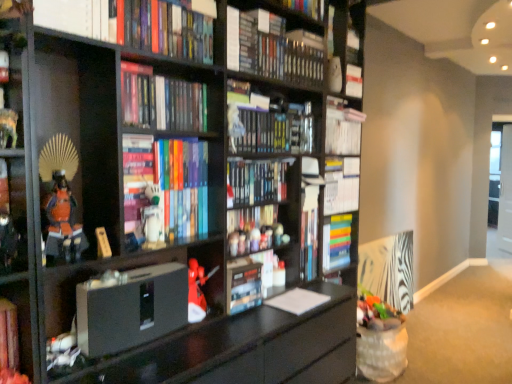
Question: Is hardcover book at upper left, which is the 6th book from bottom to top, positioned behind matte black shelf at left, which ranks as the second shelf in bottom-to-top order?

Choices:
 (A) no
 (B) yes

Answer: (B)

Question: Does hardcover book at upper left, the 4th book viewed from the top, have a smaller size compared to matte black shelf at left, which ranks as the second shelf in bottom-to-top order?

Choices:
 (A) no
 (B) yes

Answer: (A)

Question: From the image's perspective, is hardcover book at upper left, the 4th book viewed from the top, on matte black shelf at left, which ranks as the second shelf in bottom-to-top order?

Choices:
 (A) yes
 (B) no

Answer: (A)

Question: Is hardcover book at upper left, which is the 6th book from bottom to top, to the left of matte black shelf at left, which ranks as the second shelf in bottom-to-top order, from the viewer's perspective?

Choices:
 (A) yes
 (B) no

Answer: (B)

Question: From a real-world perspective, is hardcover book at upper left, the 4th book viewed from the top, beneath matte black shelf at left, which ranks as the second shelf in bottom-to-top order?

Choices:
 (A) no
 (B) yes

Answer: (A)

Question: Is hardcover book at upper left, the 4th book viewed from the top, turned away from matte black shelf at left, the first shelf in the top-to-bottom sequence?

Choices:
 (A) yes
 (B) no

Answer: (B)

Question: From a real-world perspective, is white paper at center, marked as the third paperback book in a left-to-right arrangement, beneath hardcover book at upper center, placed as the 3th book when sorted from top to bottom?

Choices:
 (A) yes
 (B) no

Answer: (A)

Question: From the image's perspective, is white paper at center, marked as the 1th paperback book in a right-to-left arrangement, on top of hardcover book at upper center, the seventh book positioned from the bottom?

Choices:
 (A) no
 (B) yes

Answer: (A)

Question: Considering the relative positions of white paper at center, marked as the third paperback book in a left-to-right arrangement, and hardcover book at upper center, placed as the 3th book when sorted from top to bottom, in the image provided, is white paper at center, marked as the third paperback book in a left-to-right arrangement, in front of hardcover book at upper center, placed as the 3th book when sorted from top to bottom,?

Choices:
 (A) no
 (B) yes

Answer: (A)

Question: Is white paper at center, marked as the third paperback book in a left-to-right arrangement, looking in the opposite direction of hardcover book at upper center, the seventh book positioned from the bottom?

Choices:
 (A) yes
 (B) no

Answer: (B)

Question: Is white paper at center, marked as the third paperback book in a left-to-right arrangement, wider than hardcover book at upper center, placed as the 3th book when sorted from top to bottom?

Choices:
 (A) yes
 (B) no

Answer: (A)

Question: Is white paper at center, marked as the 1th paperback book in a right-to-left arrangement, not inside hardcover book at upper center, the seventh book positioned from the bottom?

Choices:
 (A) yes
 (B) no

Answer: (A)

Question: Is hardcover book at center, marked as the 6th book in a top-to-bottom arrangement, wider than matte gray speaker at center, which ranks as the 1th paperback book in left-to-right order?

Choices:
 (A) yes
 (B) no

Answer: (B)